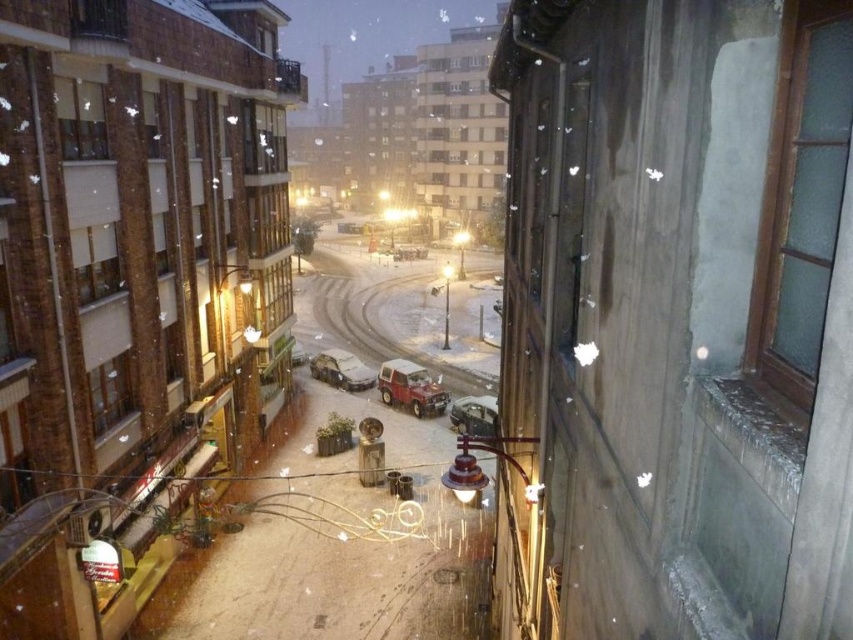
Between sleek metallic car at center and metallic silver car at center, which one is positioned higher?

sleek metallic car at center

Does sleek metallic car at center come behind metallic silver car at center?

Yes, sleek metallic car at center is behind metallic silver car at center.

Is point (329, 348) positioned behind point (467, 429)?

That is True.

I want to click on sleek metallic car at center, so click(341, 369).

Based on the photo, is sandy concrete alley at center below sleek metallic car at center?

No, sandy concrete alley at center is not below sleek metallic car at center.

Who is shorter, sandy concrete alley at center or sleek metallic car at center?

sleek metallic car at center

The width and height of the screenshot is (853, 640). In order to click on sandy concrete alley at center in this screenshot , I will do `click(335, 541)`.

At what (x,y) coordinates should I click in order to perform the action: click on sandy concrete alley at center. Please return your answer as a coordinate pair (x, y). The width and height of the screenshot is (853, 640). Looking at the image, I should click on click(x=335, y=541).

Does sandy concrete alley at center appear over metallic red car at center?

Yes, sandy concrete alley at center is above metallic red car at center.

Describe the element at coordinates (335, 541) in the screenshot. I see `sandy concrete alley at center` at that location.

Which is in front, point (361, 305) or point (404, 371)?

Point (404, 371) is in front.

Where is `sandy concrete alley at center`? sandy concrete alley at center is located at coordinates (335, 541).